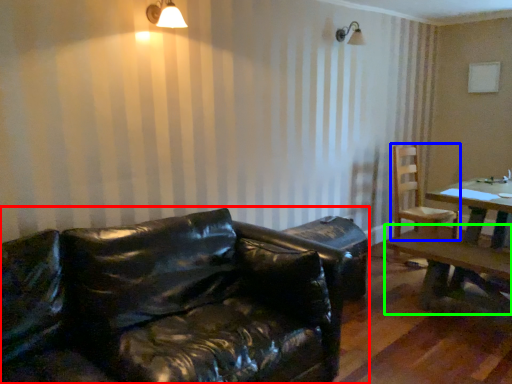
Question: Based on their relative distances, which object is nearer to studio couch (highlighted by a red box)? Choose from chair (highlighted by a blue box) and table (highlighted by a green box).

Choices:
 (A) chair
 (B) table

Answer: (B)